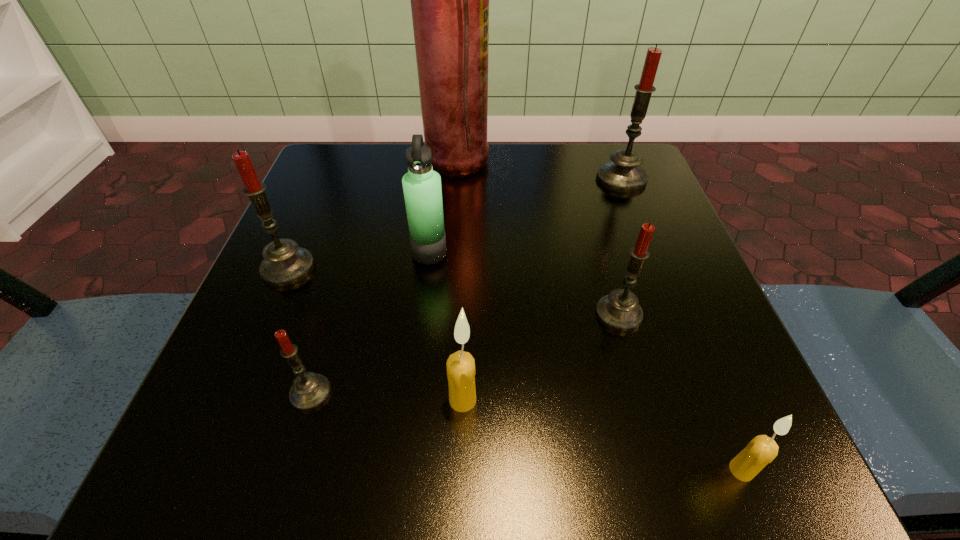
At what (x,y) coordinates should I click in order to perform the action: click on free space at the right edge. Please return your answer as a coordinate pair (x, y). Image resolution: width=960 pixels, height=540 pixels. Looking at the image, I should click on (704, 336).

Find the location of `vacant space at the far left corner of the desktop`. vacant space at the far left corner of the desktop is located at coordinates (310, 176).

In the image, there is a desktop. Where is `free space at the far right corner`? free space at the far right corner is located at coordinates (636, 205).

Find the location of a particular element. This screenshot has width=960, height=540. empty space between the nearest candle and the fourth nearest candle is located at coordinates (680, 392).

Where is `free point between the smallest red candle and the third smallest red candle`? The height and width of the screenshot is (540, 960). free point between the smallest red candle and the third smallest red candle is located at coordinates (300, 330).

Where is `empty space between the second nearest red candle and the thermos bottle`? empty space between the second nearest red candle and the thermos bottle is located at coordinates (524, 284).

Locate an element on the screen. free spot between the tallest candle and the thermos bottle is located at coordinates (525, 215).

I want to click on vacant area that lies between the nearest candle and the farther cream candle, so click(x=602, y=435).

This screenshot has height=540, width=960. I want to click on free space between the second farthest red candle and the second candle from left to right, so click(300, 330).

Find the location of a particular element. free point between the leftmost candle and the left cream candle is located at coordinates (375, 334).